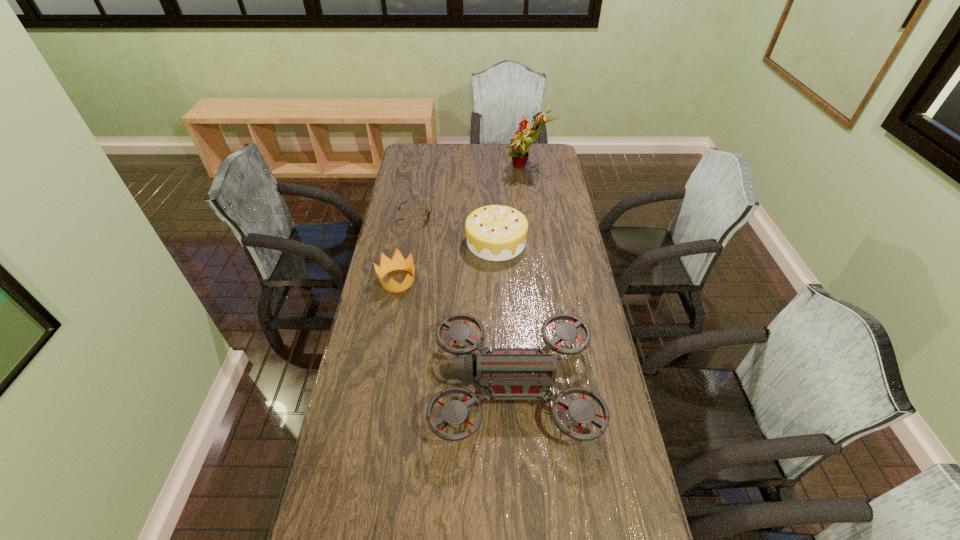
Image resolution: width=960 pixels, height=540 pixels. I want to click on the tallest object, so click(x=519, y=144).

Locate an element on the screen. The width and height of the screenshot is (960, 540). bouquet is located at coordinates (519, 144).

Where is `birthday cake`? The image size is (960, 540). birthday cake is located at coordinates (495, 232).

Where is `drone`? This screenshot has width=960, height=540. drone is located at coordinates (507, 373).

This screenshot has width=960, height=540. I want to click on the second shortest object, so click(x=398, y=262).

The height and width of the screenshot is (540, 960). Find the location of `the fourth farthest object`. the fourth farthest object is located at coordinates (398, 262).

Where is `sunglasses`? This screenshot has height=540, width=960. sunglasses is located at coordinates (429, 210).

This screenshot has height=540, width=960. I want to click on vacant space situated on the front-facing side of the bouquet, so click(x=420, y=168).

The image size is (960, 540). Find the location of `vacant area situated 0.380m on the front-facing side of the bouquet`. vacant area situated 0.380m on the front-facing side of the bouquet is located at coordinates (423, 168).

The height and width of the screenshot is (540, 960). I want to click on free space located on the front-facing side of the bouquet, so click(472, 168).